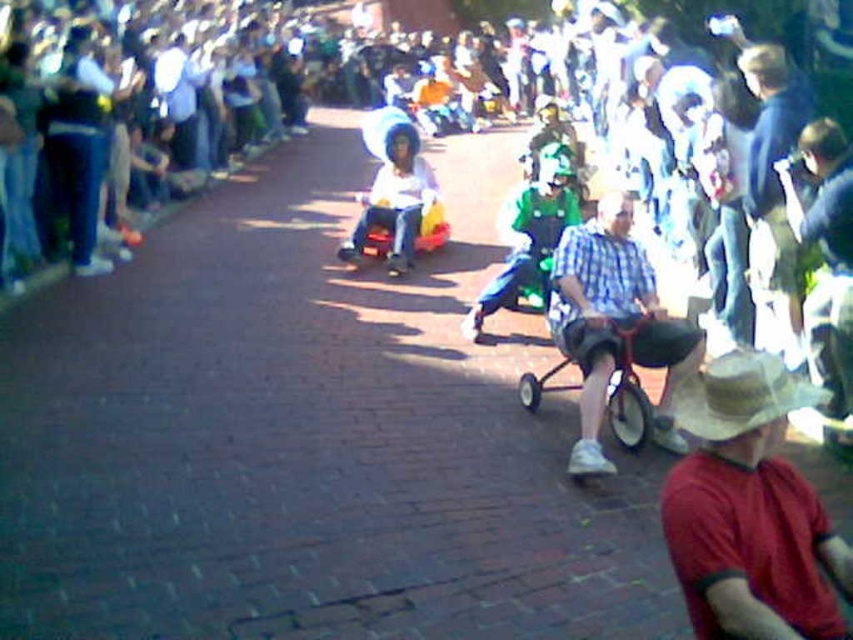
Between brown straw cowboy hat at lower right and metallic silver stroller at center, which one has less height?

With less height is brown straw cowboy hat at lower right.

Does brown straw cowboy hat at lower right have a lesser height compared to metallic silver stroller at center?

Yes, brown straw cowboy hat at lower right is shorter than metallic silver stroller at center.

Who is more forward, (724, 428) or (630, 336)?

Point (724, 428)

Identify the location of brown straw cowboy hat at lower right. (740, 394).

Where is `straw hat at center`? straw hat at center is located at coordinates (749, 509).

Who is more forward, (782, 420) or (384, 205)?

Positioned in front is point (782, 420).

Locate an element on the screen. This screenshot has height=640, width=853. straw hat at center is located at coordinates (749, 509).

Locate an element on the screen. straw hat at center is located at coordinates (749, 509).

Based on the photo, who is positioned more to the left, green fabric costume at center or matte plastic baby carriage at center?

Positioned to the left is matte plastic baby carriage at center.

Is point (537, 228) less distant than point (368, 202)?

That is True.

At what (x,y) coordinates should I click in order to perform the action: click on green fabric costume at center. Please return your answer as a coordinate pair (x, y). This screenshot has width=853, height=640. Looking at the image, I should click on (531, 240).

Where is `green fabric costume at center`? This screenshot has width=853, height=640. green fabric costume at center is located at coordinates (531, 240).